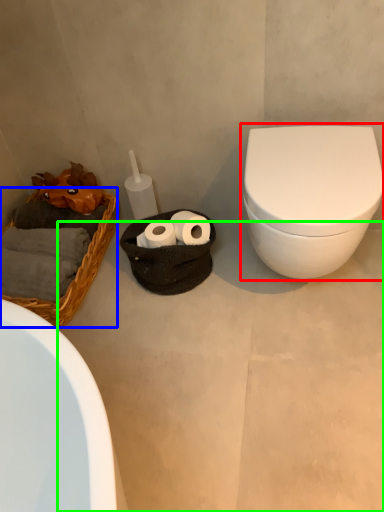
Question: Which is farther away from toilet (highlighted by a red box)? basket (highlighted by a blue box) or concrete (highlighted by a green box)?

Choices:
 (A) basket
 (B) concrete

Answer: (A)